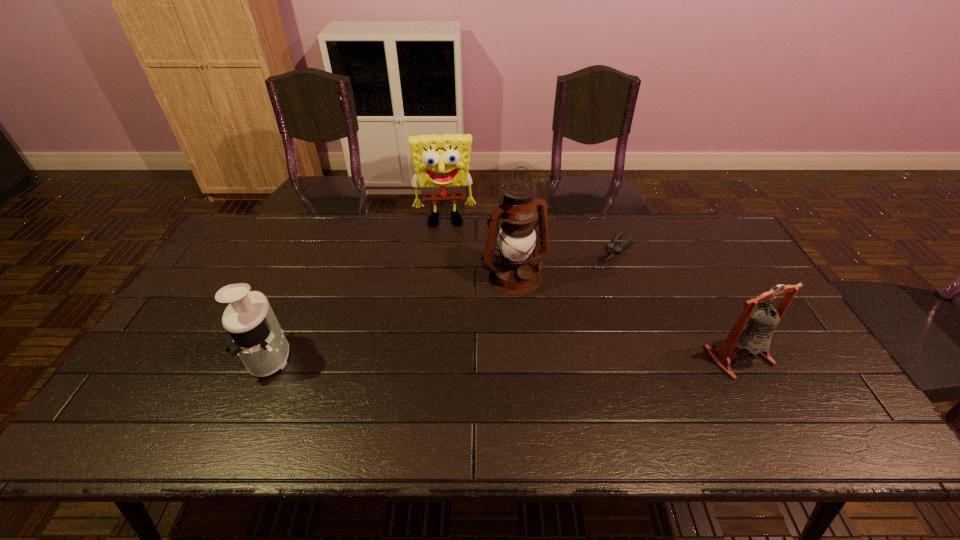
Where is `pliers that is at the far edge`? The image size is (960, 540). pliers that is at the far edge is located at coordinates (618, 249).

The image size is (960, 540). In order to click on juicer that is at the near edge in this screenshot , I will do `click(258, 339)`.

What are the coordinates of `bell at the near edge` in the screenshot? It's located at (752, 333).

Where is `object that is at the right edge`? The image size is (960, 540). object that is at the right edge is located at coordinates (752, 333).

The height and width of the screenshot is (540, 960). I want to click on object that is at the near right corner, so click(752, 333).

In the image, there is a desktop. Where is `vacant space at the far edge`? vacant space at the far edge is located at coordinates (615, 244).

Where is `vacant area at the near edge of the desktop`? The width and height of the screenshot is (960, 540). vacant area at the near edge of the desktop is located at coordinates (526, 401).

Where is `free space at the left edge of the desktop`? free space at the left edge of the desktop is located at coordinates [228, 280].

The image size is (960, 540). I want to click on free space at the far right corner, so click(x=690, y=224).

This screenshot has height=540, width=960. I want to click on free space at the near right corner, so click(x=827, y=392).